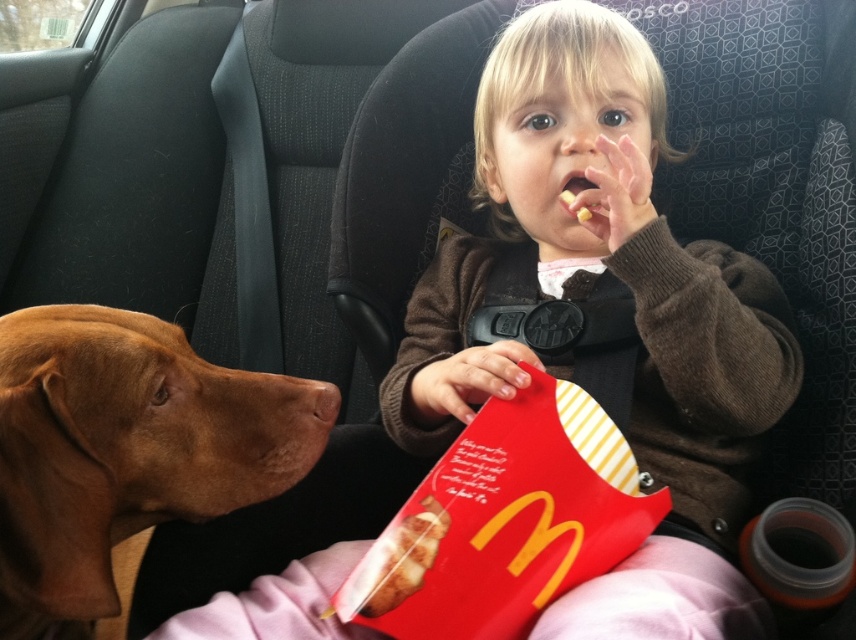
Question: Observing the image, what is the correct spatial positioning of brown fur at left in reference to yellow matte snack at center?

Choices:
 (A) right
 (B) left

Answer: (B)

Question: Among these objects, which one is farthest from the camera?

Choices:
 (A) yellow matte snack at center
 (B) brown fur at left

Answer: (A)

Question: Which point appears farthest from the camera in this image?

Choices:
 (A) (233, 456)
 (B) (577, 209)

Answer: (B)

Question: Is brown fur at left to the right of yellow matte snack at center from the viewer's perspective?

Choices:
 (A) no
 (B) yes

Answer: (A)

Question: Considering the relative positions of brown fur at left and yellow matte snack at center in the image provided, where is brown fur at left located with respect to yellow matte snack at center?

Choices:
 (A) left
 (B) right

Answer: (A)